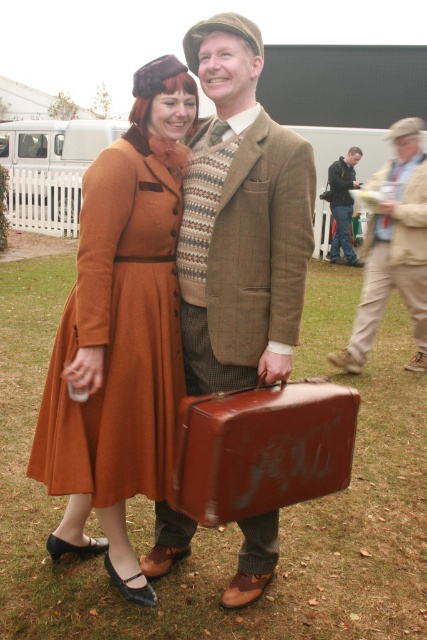
The height and width of the screenshot is (640, 427). What are the coordinates of `matte brown suit at center` in the screenshot? It's located at [x=240, y=220].

Describe the element at coordinates (240, 220) in the screenshot. I see `matte brown suit at center` at that location.

Is point (237, 566) more distant than point (70, 301)?

That is True.

Find the location of a particular element. matte brown suit at center is located at coordinates (240, 220).

What do you see at coordinates (117, 336) in the screenshot? I see `brown woolen dress at center` at bounding box center [117, 336].

Does point (163, 237) come closer to viewer compared to point (204, 449)?

No, it is behind (204, 449).

Which is in front, point (91, 236) or point (257, 477)?

Point (257, 477) is more forward.

I want to click on brown woolen dress at center, so click(117, 336).

Does matte brown suitcase at center appear over dark blue leather jacket at center?

Actually, matte brown suitcase at center is below dark blue leather jacket at center.

What do you see at coordinates (262, 449) in the screenshot? Image resolution: width=427 pixels, height=640 pixels. I see `matte brown suitcase at center` at bounding box center [262, 449].

This screenshot has width=427, height=640. What are the coordinates of `matte brown suitcase at center` in the screenshot? It's located at (262, 449).